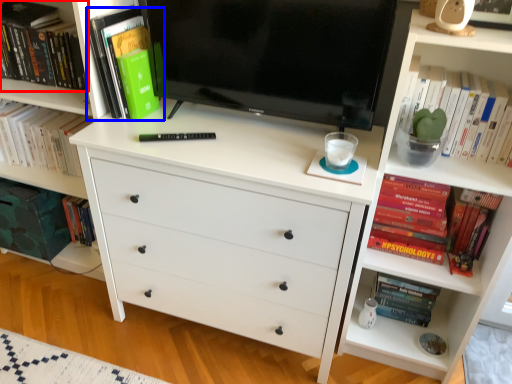
Question: Which object appears closest to the camera in this image, book (highlighted by a red box) or book (highlighted by a blue box)?

Choices:
 (A) book
 (B) book

Answer: (B)